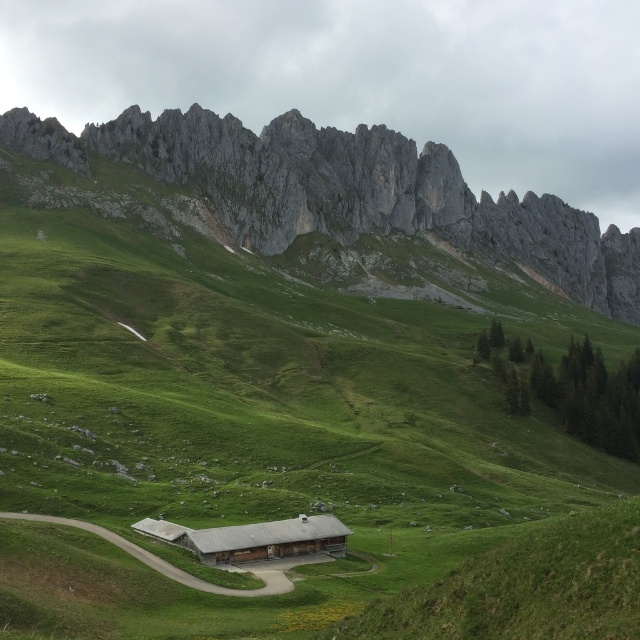
Question: Can you confirm if green grassy at center is positioned to the left of rugged stone mountain at upper center?

Choices:
 (A) yes
 (B) no

Answer: (A)

Question: Which object is the farthest from the green grassy at center?

Choices:
 (A) brown wooden barn at center
 (B) rugged stone mountain at upper center

Answer: (B)

Question: Among these objects, which one is farthest from the camera?

Choices:
 (A) green grassy at center
 (B) brown wooden barn at center

Answer: (B)

Question: Does green grassy at center have a smaller size compared to rugged stone mountain at upper center?

Choices:
 (A) no
 (B) yes

Answer: (B)

Question: Does green grassy at center lie in front of rugged stone mountain at upper center?

Choices:
 (A) yes
 (B) no

Answer: (A)

Question: Considering the real-world distances, which object is farthest from the green grassy at center?

Choices:
 (A) brown wooden barn at center
 (B) rugged stone mountain at upper center

Answer: (B)